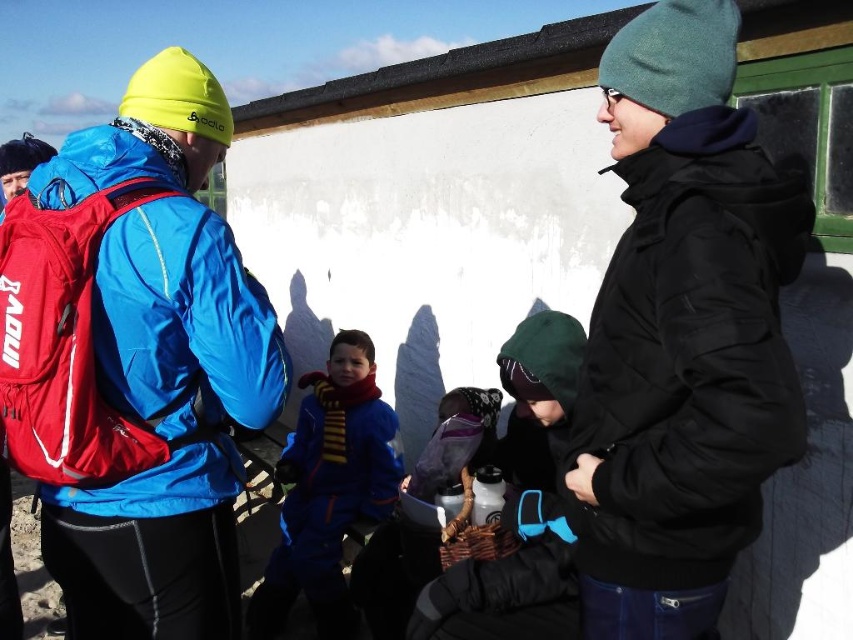
Between dark green hooded jacket at center and velvet purple scarf at center, which one appears on the left side from the viewer's perspective?

velvet purple scarf at center is more to the left.

Does point (538, 317) lie in front of point (403, 570)?

Yes, point (538, 317) is in front of point (403, 570).

Where is `dark green hooded jacket at center`? dark green hooded jacket at center is located at coordinates (521, 504).

Which is in front, point (775, 346) or point (466, 456)?

Point (775, 346) is in front.

Is black matte jacket at right shorter than velvet purple scarf at center?

Incorrect, black matte jacket at right's height does not fall short of velvet purple scarf at center's.

This screenshot has height=640, width=853. I want to click on black matte jacket at right, so click(683, 333).

At what (x,y) coordinates should I click in order to perform the action: click on black matte jacket at right. Please return your answer as a coordinate pair (x, y). The width and height of the screenshot is (853, 640). Looking at the image, I should click on (683, 333).

Does matte blue jacket at left have a greater height compared to black matte jacket at right?

Yes.

Between matte blue jacket at left and black matte jacket at right, which one has less height?

black matte jacket at right

At what (x,y) coordinates should I click in order to perform the action: click on matte blue jacket at left. Please return your answer as a coordinate pair (x, y). The image size is (853, 640). Looking at the image, I should click on (136, 362).